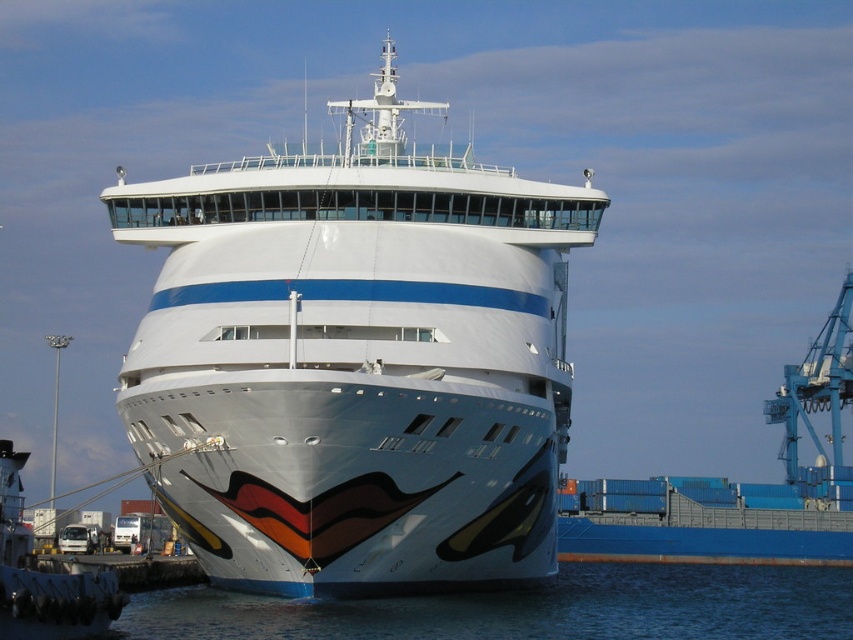
You are standing on the dock and see the point marked at coordinates (x=355, y=362). Based on the scene, what object is this point located on?

The point is located on the white glossy cruise ship at center.

You are a port authority official inspecting the docking area. From your vantage point, which object is located above the other between the white glossy cruise ship at center and the blue water at lower center?

The white glossy cruise ship at center is positioned over the blue water at lower center, meaning it is above the water.

You are standing on the cruise ship and looking out towards the dock. There is a point marked at coordinates (531, 609). What is located at that point?

The point at coordinates (531, 609) marks blue water at lower center.